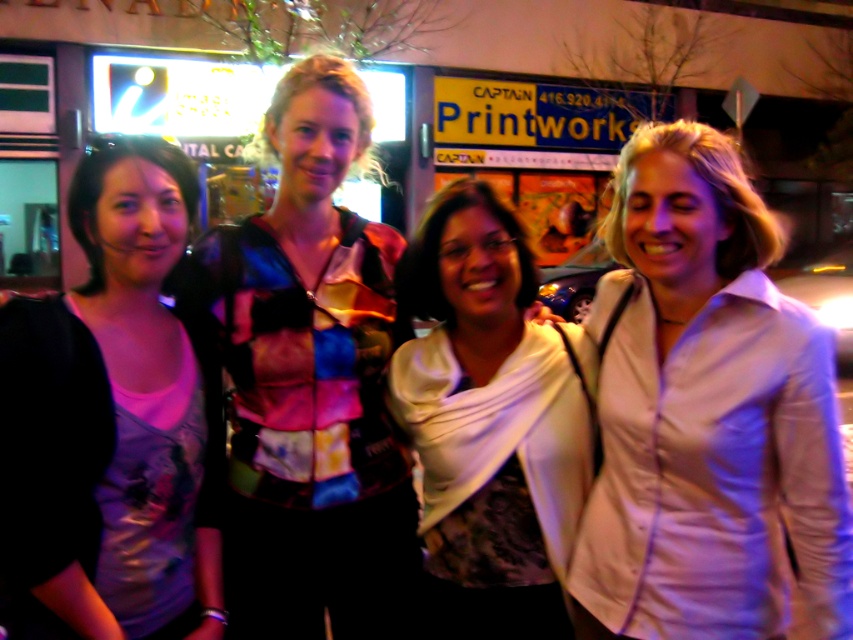
Question: Does white satin blouse at right have a lesser width compared to white satin scarf at center?

Choices:
 (A) yes
 (B) no

Answer: (B)

Question: Does multicolored patchwork shirt at center have a lesser width compared to white satin scarf at center?

Choices:
 (A) yes
 (B) no

Answer: (B)

Question: Can you confirm if white satin blouse at right is wider than white satin scarf at center?

Choices:
 (A) no
 (B) yes

Answer: (B)

Question: Among these objects, which one is nearest to the camera?

Choices:
 (A) white satin scarf at center
 (B) multicolored patchwork shirt at center
 (C) white satin blouse at right
 (D) matte black shirt at left

Answer: (D)

Question: Which point is closer to the camera?

Choices:
 (A) white satin scarf at center
 (B) matte black shirt at left

Answer: (B)

Question: Among these points, which one is farthest from the camera?

Choices:
 (A) (102, 209)
 (B) (715, 596)

Answer: (B)